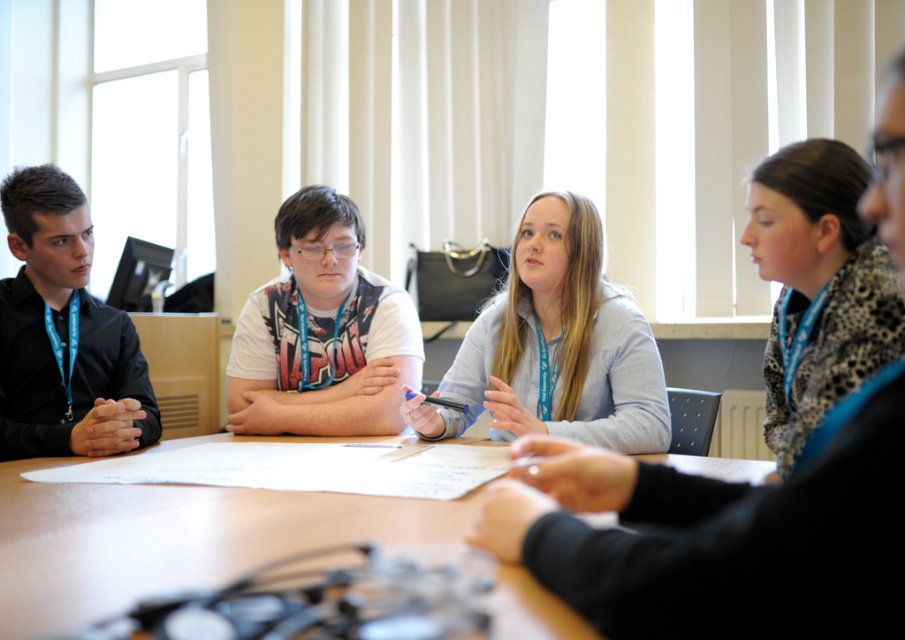
Question: Which object is farther from the camera taking this photo?

Choices:
 (A) white matte shirt at center
 (B) wooden table at center
 (C) light blue shirt at center

Answer: (A)

Question: From the image, what is the correct spatial relationship of wooden table at center in relation to light blue shirt at center?

Choices:
 (A) above
 (B) below

Answer: (B)

Question: Which object is the farthest from the white matte shirt at center?

Choices:
 (A) light blue shirt at center
 (B) wooden table at center

Answer: (B)

Question: Can you confirm if wooden table at center is bigger than light blue shirt at center?

Choices:
 (A) yes
 (B) no

Answer: (B)

Question: Which point is farther from the camera taking this photo?

Choices:
 (A) (198, 561)
 (B) (556, 323)
 (C) (262, 392)

Answer: (C)

Question: Is wooden table at center above white matte shirt at center?

Choices:
 (A) yes
 (B) no

Answer: (B)